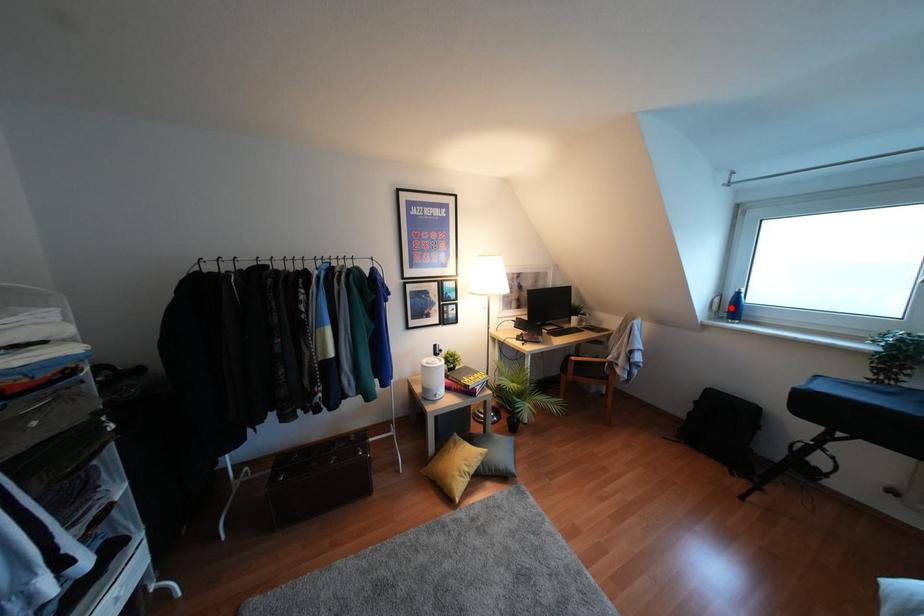
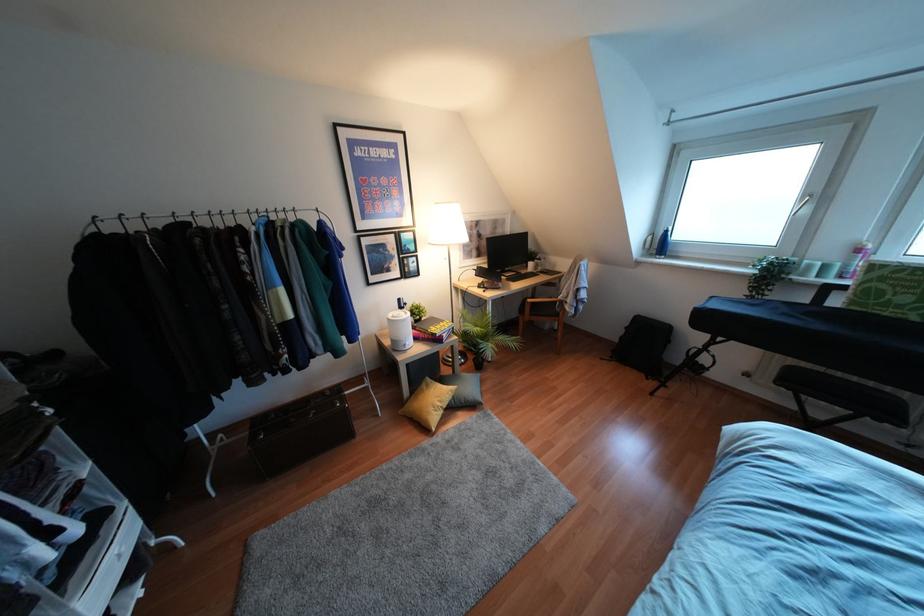
Question: A red point is marked in image1. In image2, is the corresponding 3D point closer to the camera or farther? Reply with the corresponding letter.

Choices:
 (A) The corresponding 3D point is closer.
 (B) The corresponding 3D point is farther.

Answer: (A)